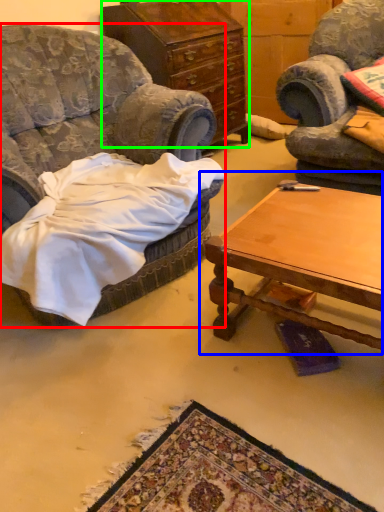
Question: Which object is the closest to the chair (highlighted by a red box)? Choose among these: coffee table (highlighted by a blue box) or cabinetry (highlighted by a green box).

Choices:
 (A) coffee table
 (B) cabinetry

Answer: (A)